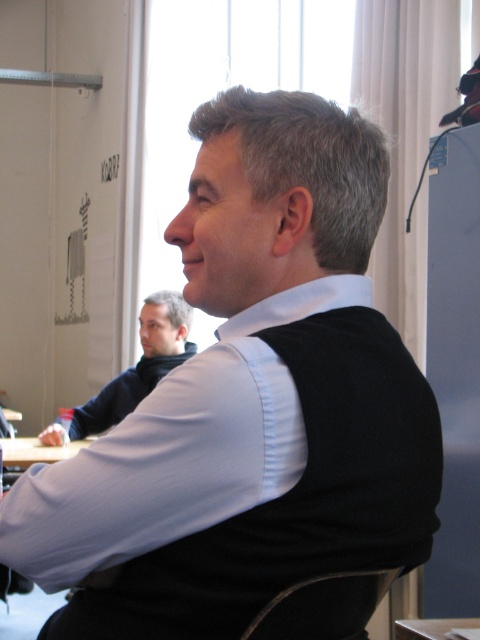
Question: Is dark blue sweater at center to the right of wooden table at center from the viewer's perspective?

Choices:
 (A) yes
 (B) no

Answer: (B)

Question: Is black leather chair at lower center positioned behind white wood table at lower left?

Choices:
 (A) no
 (B) yes

Answer: (A)

Question: Observing the image, what is the correct spatial positioning of dark blue sweater at center in reference to wooden table at center?

Choices:
 (A) above
 (B) below

Answer: (A)

Question: Which of the following is the farthest from the observer?

Choices:
 (A) black leather chair at lower center
 (B) dark blue sweater at center

Answer: (B)

Question: Estimate the real-world distances between objects in this image. Which object is closer to the wooden table at center?

Choices:
 (A) black leather chair at lower center
 (B) white wood table at lower left
 (C) dark blue sweater at center

Answer: (A)

Question: Which point is farther from the camera taking this photo?

Choices:
 (A) (159, 364)
 (B) (471, 625)
 (C) (48, 461)

Answer: (A)